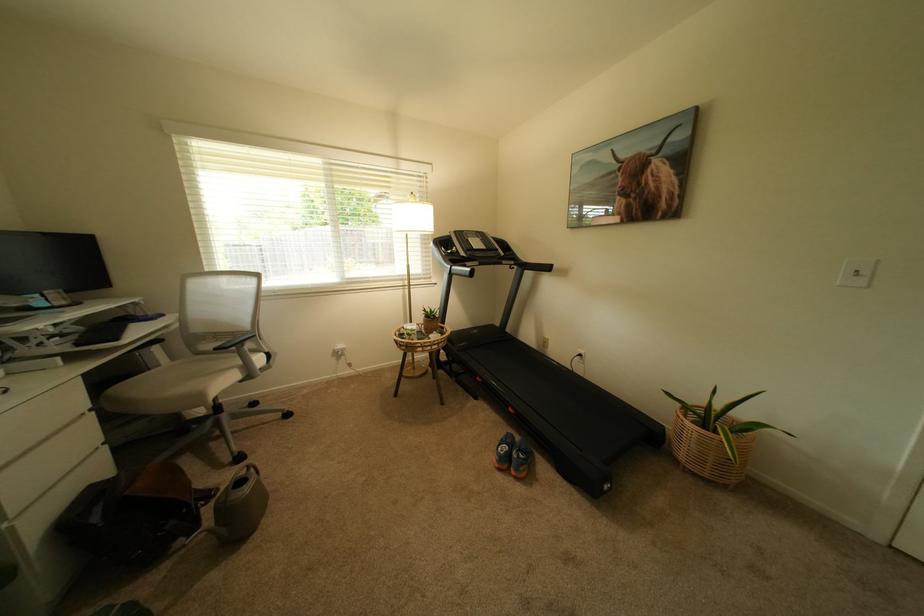
Locate an element on the screen. The width and height of the screenshot is (924, 616). blue running shoe is located at coordinates (514, 456).